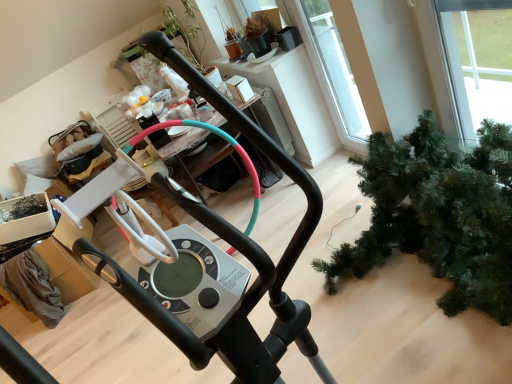
Question: Is point (462, 210) positioned closer to the camera than point (182, 283)?

Choices:
 (A) farther
 (B) closer

Answer: (A)

Question: Relative to metallic silver elliptical trainer at center, is green matte christmas tree at lower right in front or behind?

Choices:
 (A) front
 (B) behind

Answer: (B)

Question: Is green matte christmas tree at lower right taller or shorter than metallic silver elliptical trainer at center?

Choices:
 (A) short
 (B) tall

Answer: (A)

Question: Considering the relative positions of metallic silver elliptical trainer at center and green matte christmas tree at lower right in the image provided, is metallic silver elliptical trainer at center to the left or to the right of green matte christmas tree at lower right?

Choices:
 (A) right
 (B) left

Answer: (B)

Question: Relative to green matte christmas tree at lower right, is metallic silver elliptical trainer at center in front or behind?

Choices:
 (A) front
 (B) behind

Answer: (A)

Question: Considering the positions of metallic silver elliptical trainer at center and green matte christmas tree at lower right in the image, is metallic silver elliptical trainer at center bigger or smaller than green matte christmas tree at lower right?

Choices:
 (A) big
 (B) small

Answer: (A)

Question: Is metallic silver elliptical trainer at center wider or thinner than green matte christmas tree at lower right?

Choices:
 (A) thin
 (B) wide

Answer: (A)